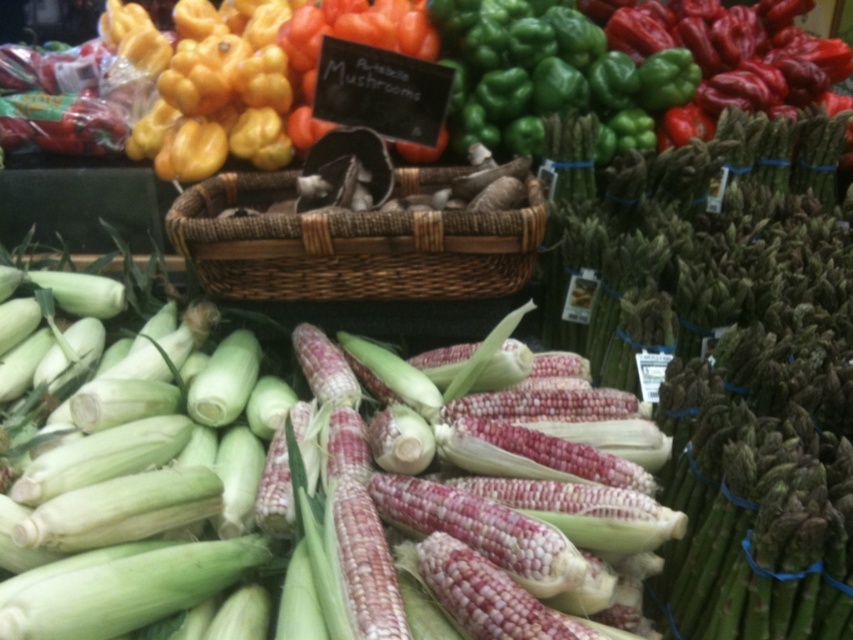
Question: Is green matte corn at center to the right of woven brown basket at center from the viewer's perspective?

Choices:
 (A) no
 (B) yes

Answer: (A)

Question: From the image, what is the correct spatial relationship of green matte corn at center in relation to woven brown basket at center?

Choices:
 (A) right
 (B) left

Answer: (B)

Question: Is the position of green matte corn at center less distant than that of woven brown basket at center?

Choices:
 (A) no
 (B) yes

Answer: (B)

Question: Which object is farther from the camera taking this photo?

Choices:
 (A) woven brown basket at center
 (B) green matte corn at center

Answer: (A)

Question: Which of the following is the closest to the observer?

Choices:
 (A) (183, 422)
 (B) (426, 179)

Answer: (A)

Question: Among these points, which one is farthest from the camera?

Choices:
 (A) (235, 292)
 (B) (312, 467)

Answer: (A)